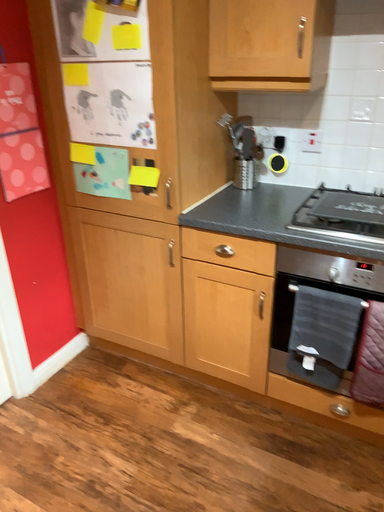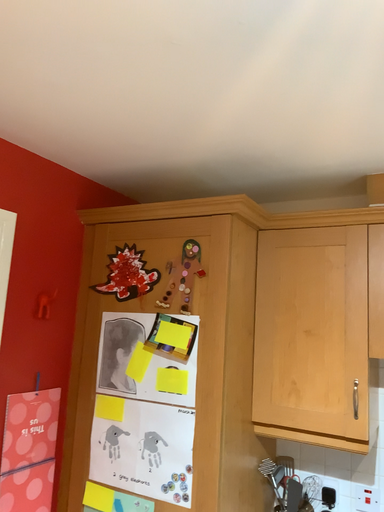
Question: How did the camera likely rotate when shooting the video?

Choices:
 (A) rotated downward
 (B) rotated upward

Answer: (B)